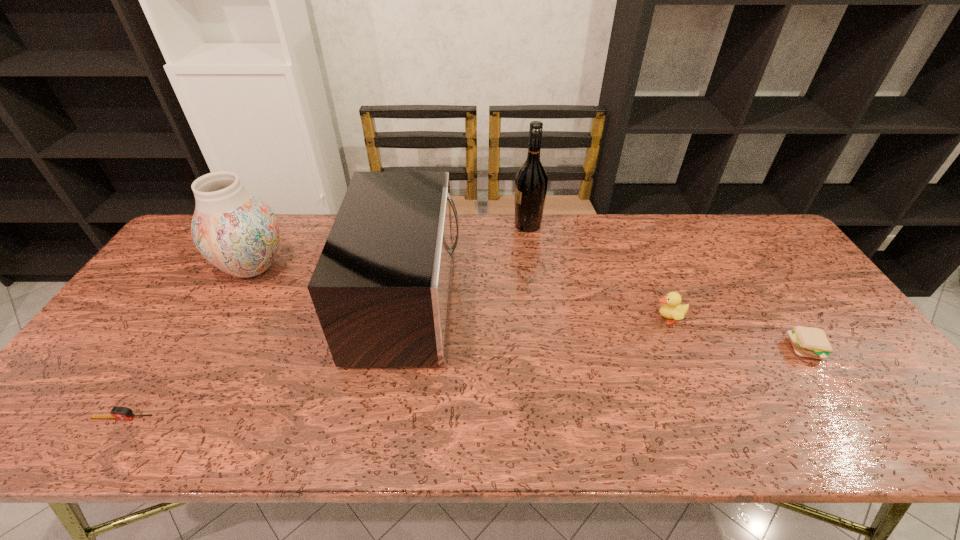
Find the location of a particular element. The image size is (960, 540). vacant area located 0.100m on the label of the farthest object is located at coordinates (484, 225).

Locate an element on the screen. The height and width of the screenshot is (540, 960). free space located 0.330m on the label of the farthest object is located at coordinates (417, 225).

At what (x,y) coordinates should I click in order to perform the action: click on vacant area located 0.250m on the label of the farthest object. Please return your answer as a coordinate pair (x, y). The image size is (960, 540). Looking at the image, I should click on (440, 225).

I want to click on vacant point located 0.140m on the back of the vase, so click(x=280, y=219).

The image size is (960, 540). I want to click on free region located with the door open on the third object from left to right, so click(597, 301).

You are a GUI agent. You are given a task and a screenshot of the screen. Output one action in this format:
    pyautogui.click(x=<x>, y=<y>)
    Task: Click on the free space located on the front-facing side of the second object from right to left
    This screenshot has height=540, width=960.
    Given the screenshot: What is the action you would take?
    pyautogui.click(x=513, y=319)

You are a GUI agent. You are given a task and a screenshot of the screen. Output one action in this format:
    pyautogui.click(x=<x>, y=<y>)
    Task: Click on the vacant region located on the front-facing side of the second object from right to left
    The height and width of the screenshot is (540, 960).
    Given the screenshot: What is the action you would take?
    pyautogui.click(x=587, y=319)

The image size is (960, 540). Find the location of `free space located on the front-facing side of the second object from right to left`. free space located on the front-facing side of the second object from right to left is located at coordinates (631, 319).

Identify the location of vacant space located on the back of the patty. This screenshot has height=540, width=960. (781, 313).

You are a GUI agent. You are given a task and a screenshot of the screen. Output one action in this format:
    pyautogui.click(x=<x>, y=<y>)
    Task: Click on the free space located on the back of the nearest object
    Image resolution: width=960 pixels, height=540 pixels.
    Given the screenshot: What is the action you would take?
    pyautogui.click(x=138, y=395)